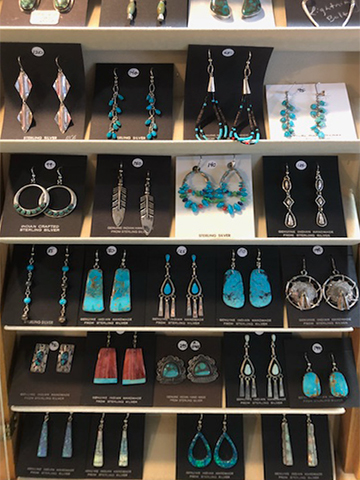
In order to click on black earring holder in this screenshot , I will do `click(48, 382)`, `click(113, 388)`, `click(325, 363)`, `click(255, 352)`, `click(306, 440)`, `click(216, 422)`, `click(139, 426)`, `click(54, 441)`.